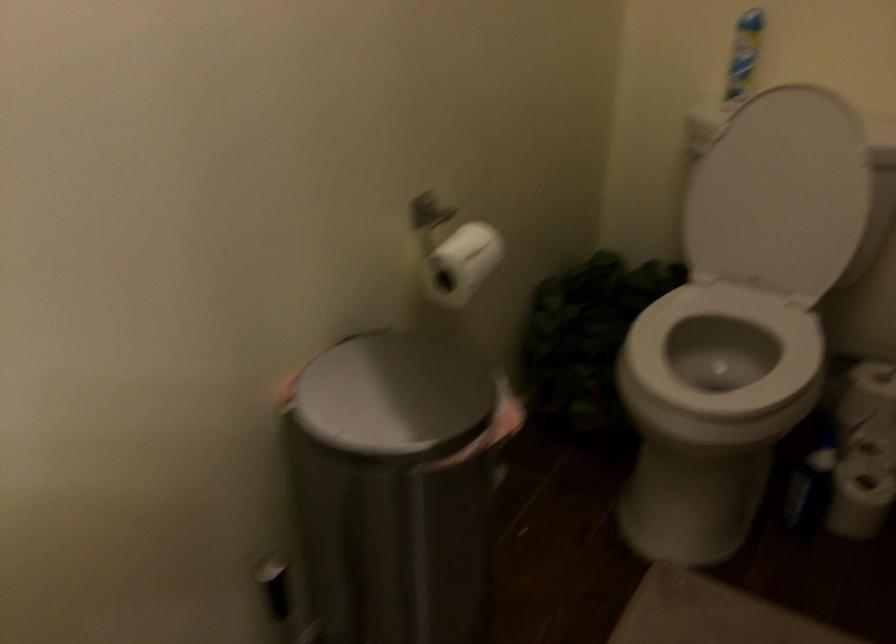
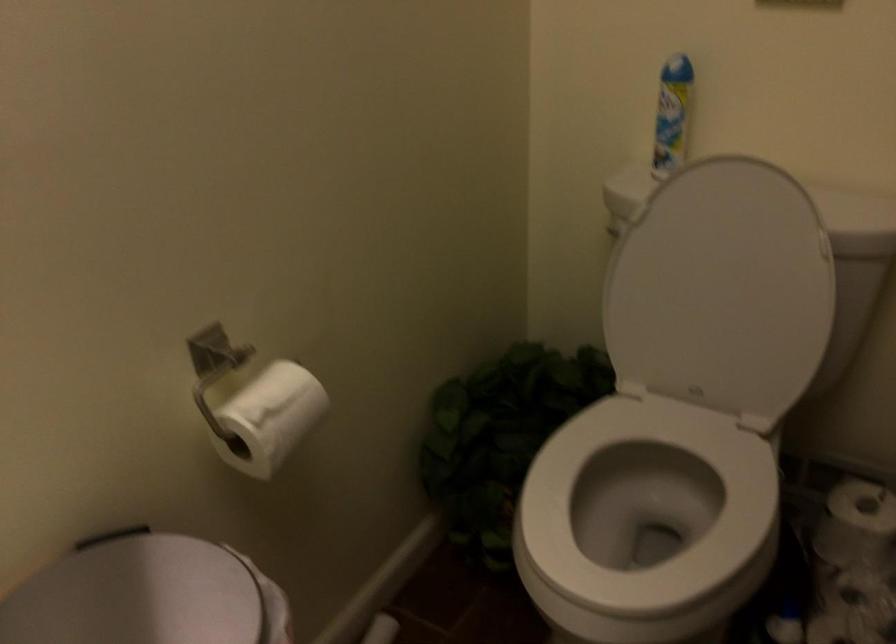
In the second image, find the point that corresponds to point (394, 370) in the first image.

(138, 594)